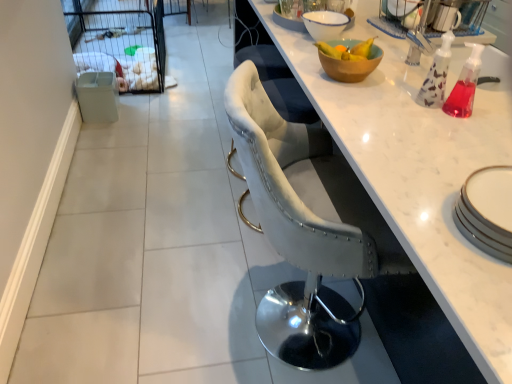
The width and height of the screenshot is (512, 384). Find the location of `vacant space that's between velvet grey chair at center and white mesh screen door at upper left`. vacant space that's between velvet grey chair at center and white mesh screen door at upper left is located at coordinates (175, 158).